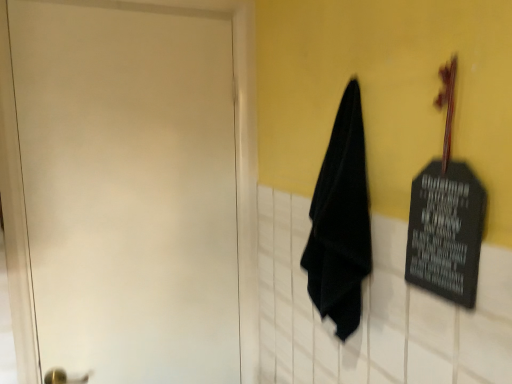
Describe the element at coordinates (341, 221) in the screenshot. I see `black matte towel at center` at that location.

Locate an element on the screen. The image size is (512, 384). black matte towel at center is located at coordinates (341, 221).

This screenshot has width=512, height=384. I want to click on white matte door at left, so click(129, 189).

The image size is (512, 384). Describe the element at coordinates (129, 189) in the screenshot. I see `white matte door at left` at that location.

Identify the location of black matte towel at center. (341, 221).

Is white matte door at left at the left side of black matte towel at center?

Yes, white matte door at left is to the left of black matte towel at center.

Relative to black matte towel at center, is white matte door at left in front or behind?

Clearly, white matte door at left is behind black matte towel at center.

Is point (200, 157) positioned before point (356, 220)?

No, it is not.

From the image's perspective, would you say white matte door at left is positioned over black matte towel at center?

No, from the image's perspective, white matte door at left is not above black matte towel at center.

From a real-world perspective, is white matte door at left positioned above or below black matte towel at center?

Clearly, from a real-world perspective, white matte door at left is below black matte towel at center.

In terms of width, does white matte door at left look wider or thinner when compared to black matte towel at center?

Considering their sizes, white matte door at left looks slimmer than black matte towel at center.

Considering the sizes of white matte door at left and black matte towel at center in the image, is white matte door at left taller or shorter than black matte towel at center?

Considering their sizes, white matte door at left has more height than black matte towel at center.

Can you confirm if white matte door at left is bigger than black matte towel at center?

Yes, white matte door at left is bigger than black matte towel at center.

Would you say black matte towel at center is part of white matte door at left's contents?

No, black matte towel at center is not inside white matte door at left.

Are white matte door at left and black matte towel at center located far from each other?

Actually, white matte door at left and black matte towel at center are a little close together.

Could you tell me if white matte door at left is facing black matte towel at center?

Yes.

From the picture: How different are the orientations of white matte door at left and black matte towel at center in degrees?

The facing directions of white matte door at left and black matte towel at center are 90.4 degrees apart.

Where is `cloth above the white matte door at left (from a real-world perspective)`? The height and width of the screenshot is (384, 512). cloth above the white matte door at left (from a real-world perspective) is located at coordinates (341, 221).

Which object is positioned more to the right, black matte towel at center or white matte door at left?

black matte towel at center is more to the right.

Relative to white matte door at left, is black matte towel at center in front or behind?

black matte towel at center is in front of white matte door at left.

Which is closer to the camera, (x=361, y=239) or (x=30, y=137)?

Point (x=361, y=239)

From the image's perspective, between black matte towel at center and white matte door at left, who is located below?

white matte door at left appears lower in the image.

From a real-world perspective, is black matte towel at center physically below white matte door at left?

Actually, black matte towel at center is physically above white matte door at left in the real world.

Can you confirm if black matte towel at center is thinner than white matte door at left?

In fact, black matte towel at center might be wider than white matte door at left.

Based on the photo, is black matte towel at center taller than white matte door at left?

Incorrect, the height of black matte towel at center is not larger of that of white matte door at left.

Does black matte towel at center have a smaller size compared to white matte door at left?

Correct, black matte towel at center occupies less space than white matte door at left.

Is black matte towel at center inside the boundaries of white matte door at left, or outside?

black matte towel at center cannot be found inside white matte door at left.

Would you consider black matte towel at center to be distant from white matte door at left?

Actually, black matte towel at center and white matte door at left are a little close together.

Is black matte towel at center oriented away from white matte door at left?

No, black matte towel at center is not facing the opposite direction of white matte door at left.

Find the location of `cloth that is above the white matte door at left (from a real-world perspective)`. cloth that is above the white matte door at left (from a real-world perspective) is located at coordinates tap(341, 221).

Where is `cloth lying above the white matte door at left (from the image's perspective)`? The width and height of the screenshot is (512, 384). cloth lying above the white matte door at left (from the image's perspective) is located at coordinates (341, 221).

In the image, there is a black matte towel at center. In order to click on door below it (from the image's perspective) in this screenshot , I will do `click(129, 189)`.